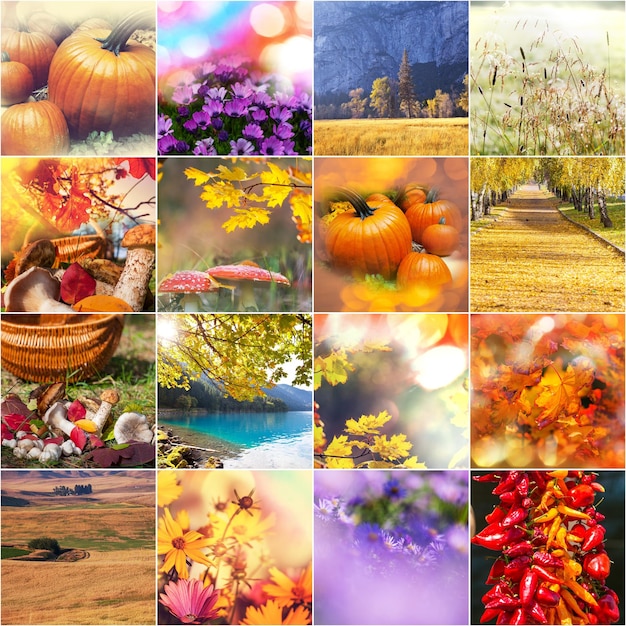
The width and height of the screenshot is (626, 626). I want to click on boxes in bottom 2 rows, so click(91, 551), click(223, 551), click(402, 543), click(539, 535), click(525, 389), click(347, 394), click(228, 404), click(101, 413).